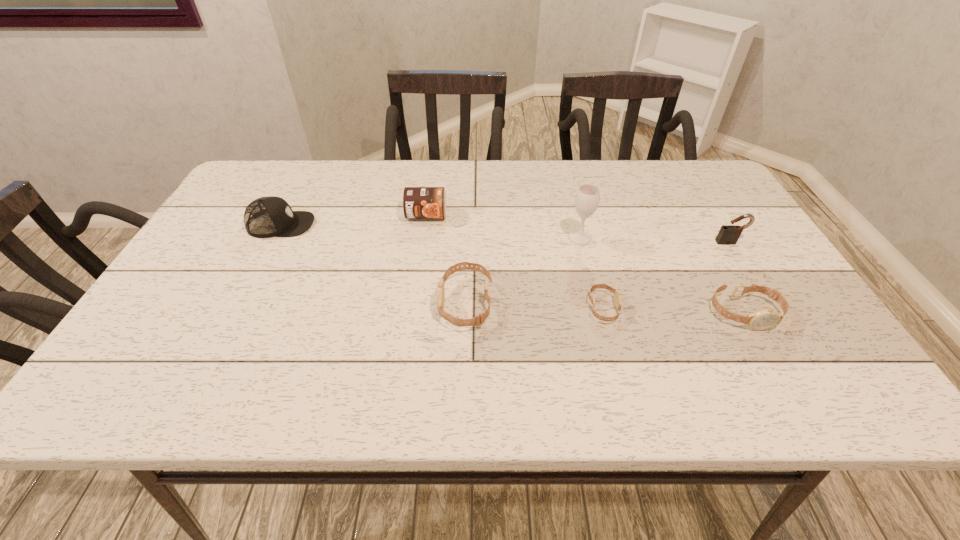
The width and height of the screenshot is (960, 540). What are the coordinates of `the leftmost watch` in the screenshot? It's located at (479, 319).

Find the location of a particular element. This screenshot has width=960, height=540. the shortest object is located at coordinates (617, 294).

This screenshot has height=540, width=960. What are the coordinates of `the shortest watch` in the screenshot? It's located at tap(617, 294).

This screenshot has height=540, width=960. I want to click on the rightmost watch, so point(764,319).

At what (x,y) coordinates should I click in order to perform the action: click on the second shortest watch. Please return your answer as a coordinate pair (x, y). The height and width of the screenshot is (540, 960). Looking at the image, I should click on click(764, 319).

Find the location of a particular element. This screenshot has width=960, height=540. padlock is located at coordinates (729, 234).

Find the location of a particular element. This screenshot has height=540, width=960. the leftmost object is located at coordinates (265, 217).

Find the location of a particular element. The image size is (960, 540). wineglass is located at coordinates (587, 198).

The width and height of the screenshot is (960, 540). What are the coordinates of `the sixth object from right to left` in the screenshot? It's located at (418, 202).

At what (x,y) coordinates should I click in order to perform the action: click on vacant space located 0.070m on the face of the third object from left to right. Please return your answer as a coordinate pair (x, y). The width and height of the screenshot is (960, 540). Looking at the image, I should click on (408, 303).